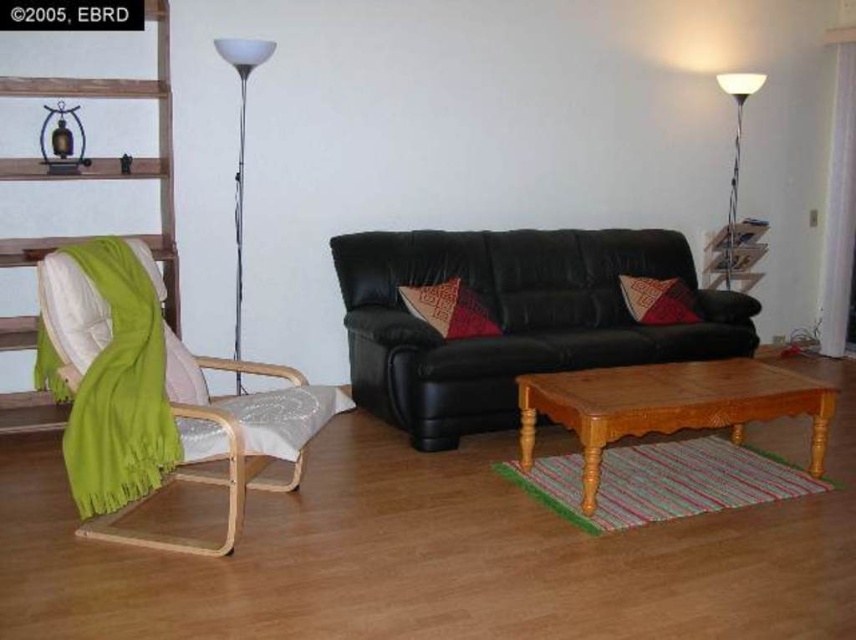
Question: Which of these objects is positioned farthest from the white glossy floor lamp at right?

Choices:
 (A) metallic silver floor lamp at left
 (B) light brown wooden coffee table at center
 (C) green fabric chair at left
 (D) black leather couch at center

Answer: (C)

Question: Which point is farther to the camera?

Choices:
 (A) (596, 304)
 (B) (759, 86)
 (C) (687, 301)
 (D) (597, 388)

Answer: (B)

Question: Which point is farther from the camera taking this photo?

Choices:
 (A) (581, 484)
 (B) (431, 298)

Answer: (B)

Question: Is light brown wooden coffee table at center smaller than green fabric chair at left?

Choices:
 (A) no
 (B) yes

Answer: (A)

Question: Can you confirm if green fabric-covered chair at left is bigger than green fabric chair at left?

Choices:
 (A) yes
 (B) no

Answer: (A)

Question: Does black leather couch at center lie behind red woven pillow at center?

Choices:
 (A) no
 (B) yes

Answer: (A)